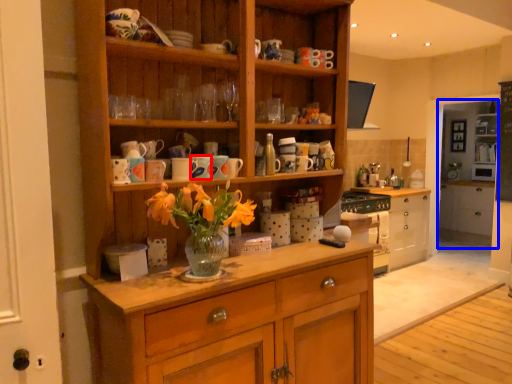
Question: Which object is closer to the camera taking this photo, mug (highlighted by a red box) or shelf (highlighted by a blue box)?

Choices:
 (A) mug
 (B) shelf

Answer: (A)